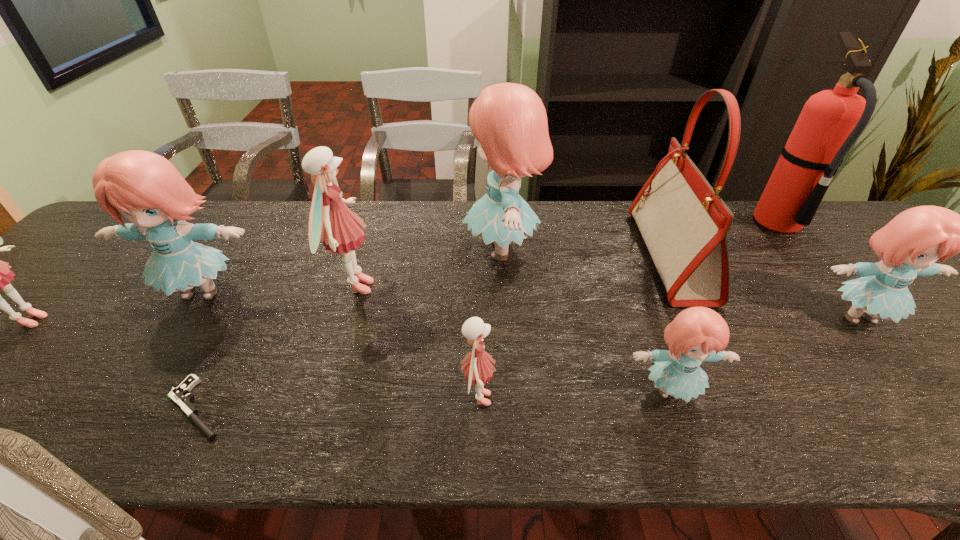
Locate an element on the screen. The width and height of the screenshot is (960, 540). free spot located on the front-facing side of the shortest object is located at coordinates (86, 408).

Where is `fire extinguisher that is at the far edge`? fire extinguisher that is at the far edge is located at coordinates (830, 122).

At what (x,y) coordinates should I click in order to perform the action: click on doll that is positioned at the far edge. Please return your answer as a coordinate pair (x, y). The width and height of the screenshot is (960, 540). Looking at the image, I should click on (509, 120).

Image resolution: width=960 pixels, height=540 pixels. Identify the location of handbag located at the far edge. (684, 223).

Identify the location of pistol located at the near edge. (x=179, y=395).

In order to click on fire extinguisher situated at the right edge in this screenshot , I will do coord(830,122).

Find the location of `doll positioned at the right edge`. doll positioned at the right edge is located at coordinates (908, 246).

This screenshot has width=960, height=540. I want to click on object that is at the far right corner, so click(x=830, y=122).

Identify the location of free region at the far edge of the desktop. (563, 240).

Find the location of `free space at the near edge of the desktop`. free space at the near edge of the desktop is located at coordinates (172, 438).